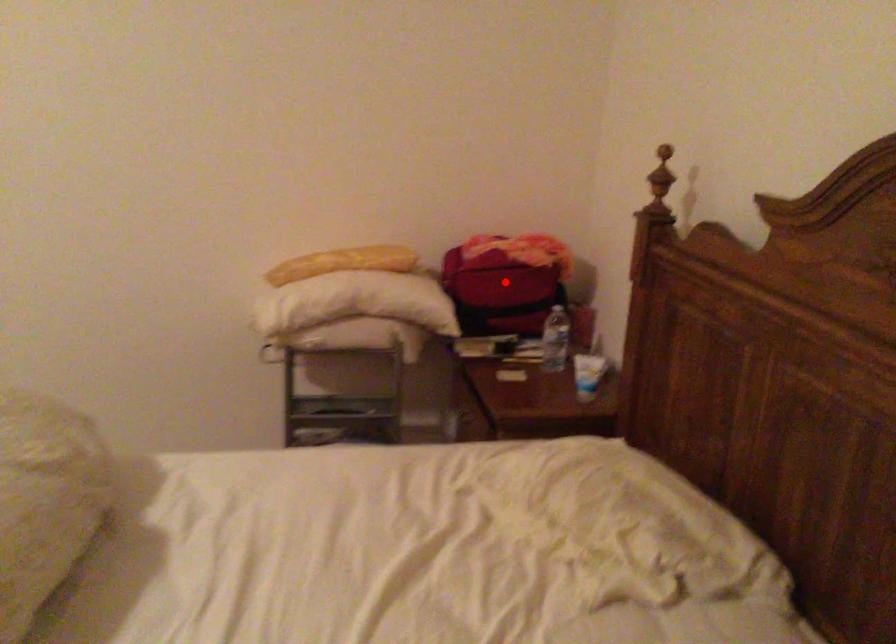
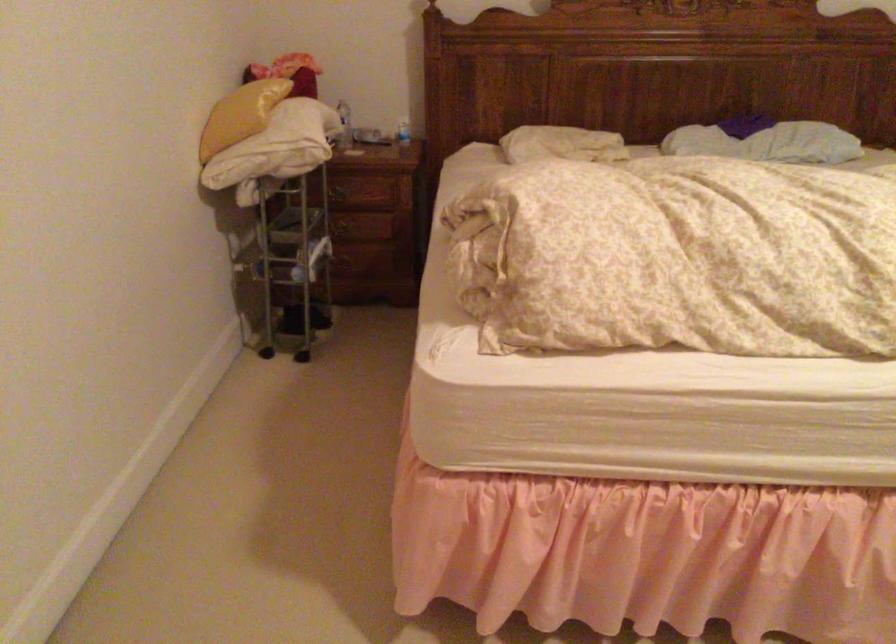
Question: I am providing you with two images of the same scene from different viewpoints. A red point is marked on the first image. Can you still see the location of the red point in image 2?

Choices:
 (A) Yes
 (B) No

Answer: (B)